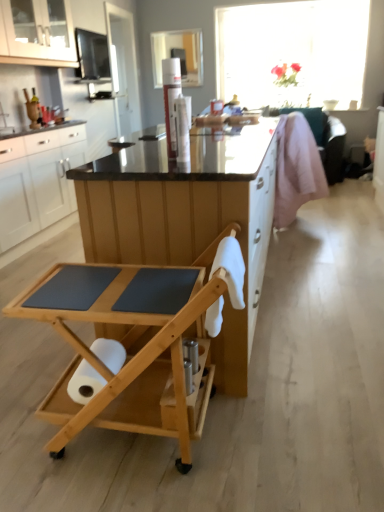
Measure the distance between white matte cabinet at left, arranged as the first cabinetry when ordered from the bottom, and camera.

white matte cabinet at left, arranged as the first cabinetry when ordered from the bottom, and camera are 2.90 meters apart.

Identify the location of white matte toilet paper at lower left. (85, 383).

The image size is (384, 512). Describe the element at coordinates (130, 340) in the screenshot. I see `natural wood rolling cart at center` at that location.

How much space does white glossy cabinet at upper left, placed as the 1th cabinetry when sorted from top to bottom, occupy horizontally?

The width of white glossy cabinet at upper left, placed as the 1th cabinetry when sorted from top to bottom, is 11.43 inches.

The height and width of the screenshot is (512, 384). Describe the element at coordinates (37, 33) in the screenshot. I see `white glossy cabinet at upper left, placed as the 1th cabinetry when sorted from top to bottom` at that location.

The width and height of the screenshot is (384, 512). I want to click on transparent glass vase at upper center, so click(x=292, y=52).

From a real-world perspective, is white matte toilet paper at lower left positioned under transparent glass vase at upper center based on gravity?

Indeed, from a real-world perspective, white matte toilet paper at lower left is positioned beneath transparent glass vase at upper center.

Looking at this image, considering the sizes of objects white matte toilet paper at lower left and transparent glass vase at upper center in the image provided, who is shorter, white matte toilet paper at lower left or transparent glass vase at upper center?

white matte toilet paper at lower left.

The height and width of the screenshot is (512, 384). Find the location of `window located on the right of white matte toilet paper at lower left`. window located on the right of white matte toilet paper at lower left is located at coordinates (292, 52).

Which object is closer to the camera taking this photo, white matte cabinet at left, which appears as the 2th cabinetry when viewed from the top, or natural wood rolling cart at center?

natural wood rolling cart at center is closer to the camera.

Can you tell me how much white matte cabinet at left, which appears as the 2th cabinetry when viewed from the top, and natural wood rolling cart at center differ in facing direction?

87.2 degrees.

Can you confirm if white matte cabinet at left, arranged as the first cabinetry when ordered from the bottom, is smaller than natural wood rolling cart at center?

Actually, white matte cabinet at left, arranged as the first cabinetry when ordered from the bottom, might be larger than natural wood rolling cart at center.

In the scene shown: Which object is thinner, white matte cabinet at left, which appears as the 2th cabinetry when viewed from the top, or natural wood rolling cart at center?

With smaller width is white matte cabinet at left, which appears as the 2th cabinetry when viewed from the top.

Which of these two, natural wood rolling cart at center or transparent glass vase at upper center, is smaller?

With smaller size is natural wood rolling cart at center.

Is natural wood rolling cart at center outside of transparent glass vase at upper center?

Yes.

Is natural wood rolling cart at center aimed at transparent glass vase at upper center?

No.

Is point (30, 313) behind point (316, 98)?

No.

Is wooden rolling cart at center positioned with its back to white glossy cabinet at upper left, placed as the 1th cabinetry when sorted from top to bottom?

No, white glossy cabinet at upper left, placed as the 1th cabinetry when sorted from top to bottom, is not at the back of wooden rolling cart at center.

Would you say wooden rolling cart at center is inside or outside white glossy cabinet at upper left, placed as the 1th cabinetry when sorted from top to bottom?

wooden rolling cart at center exists outside the volume of white glossy cabinet at upper left, placed as the 1th cabinetry when sorted from top to bottom.

Does wooden rolling cart at center come behind white glossy cabinet at upper left, placed as the 1th cabinetry when sorted from top to bottom?

That is False.

Between point (192, 220) and point (6, 8), which one is positioned in front?

The point (192, 220) is more forward.

Is wooden rolling cart at center at the right side of transparent glass vase at upper center?

In fact, wooden rolling cart at center is to the left of transparent glass vase at upper center.

Is wooden rolling cart at center taller or shorter than transparent glass vase at upper center?

Clearly, wooden rolling cart at center is shorter compared to transparent glass vase at upper center.

From a real-world perspective, does wooden rolling cart at center sit lower than transparent glass vase at upper center?

Correct, in the physical world, wooden rolling cart at center is lower than transparent glass vase at upper center.

From the picture: From the image's perspective, is white matte cabinet at left, arranged as the first cabinetry when ordered from the bottom, located above white matte toilet paper at lower left?

Yes, from the image's perspective, white matte cabinet at left, arranged as the first cabinetry when ordered from the bottom, is above white matte toilet paper at lower left.

Who is bigger, white matte cabinet at left, arranged as the first cabinetry when ordered from the bottom, or white matte toilet paper at lower left?

Bigger between the two is white matte cabinet at left, arranged as the first cabinetry when ordered from the bottom.

Between white matte cabinet at left, which appears as the 2th cabinetry when viewed from the top, and white matte toilet paper at lower left, which one has smaller width?

With smaller width is white matte toilet paper at lower left.

Visually, is white matte cabinet at left, arranged as the first cabinetry when ordered from the bottom, positioned to the left or to the right of white matte toilet paper at lower left?

From the image, it's evident that white matte cabinet at left, arranged as the first cabinetry when ordered from the bottom, is to the left of white matte toilet paper at lower left.

Is point (79, 365) less distant than point (22, 44)?

Yes, point (79, 365) is in front of point (22, 44).

Between white matte toilet paper at lower left and white glossy cabinet at upper left, placed as the 1th cabinetry when sorted from top to bottom, which one appears on the right side from the viewer's perspective?

Positioned to the right is white matte toilet paper at lower left.

Between white matte toilet paper at lower left and white glossy cabinet at upper left, placed as the 1th cabinetry when sorted from top to bottom, which one has larger size?

white glossy cabinet at upper left, placed as the 1th cabinetry when sorted from top to bottom, is bigger.

Locate an element on the screen. window above the white matte toilet paper at lower left (from a real-world perspective) is located at coordinates (292, 52).

Identify the location of table below the white matte cabinet at left, arranged as the first cabinetry when ordered from the bottom (from the image's perspective). This screenshot has height=512, width=384. (130, 340).

Considering their positions, is white glossy cabinet at upper left, which is the 2th cabinetry from bottom to top, positioned further to white matte cabinet at left, arranged as the first cabinetry when ordered from the bottom, than natural wood rolling cart at center?

The object further to white matte cabinet at left, arranged as the first cabinetry when ordered from the bottom, is natural wood rolling cart at center.

Looking at the image, which one is located closer to wooden rolling cart at center, pink fabric swivel chair at right or transparent glass vase at upper center?

pink fabric swivel chair at right lies closer to wooden rolling cart at center than the other object.

Based on the photo, looking at the image, which one is located further to wooden rolling cart at center, natural wood rolling cart at center or pink fabric swivel chair at right?

pink fabric swivel chair at right lies further to wooden rolling cart at center than the other object.

Which object lies nearer to the anchor point pink fabric swivel chair at right, white glossy cabinet at upper left, placed as the 1th cabinetry when sorted from top to bottom, or white matte cabinet at left, arranged as the first cabinetry when ordered from the bottom?

white matte cabinet at left, arranged as the first cabinetry when ordered from the bottom, lies closer to pink fabric swivel chair at right than the other object.

Which object lies nearer to the anchor point wooden rolling cart at center, white glossy cabinet at upper left, which is the 2th cabinetry from bottom to top, or pink fabric swivel chair at right?

The object closer to wooden rolling cart at center is pink fabric swivel chair at right.

From the image, which object appears to be nearer to wooden rolling cart at center, transparent glass vase at upper center or natural wood rolling cart at center?

Based on the image, natural wood rolling cart at center appears to be nearer to wooden rolling cart at center.

From the image, which object appears to be nearer to white matte toilet paper at lower left, pink fabric swivel chair at right or natural wood rolling cart at center?

Among the two, natural wood rolling cart at center is located nearer to white matte toilet paper at lower left.

Looking at the image, which one is located further to white matte toilet paper at lower left, natural wood rolling cart at center or wooden rolling cart at center?

The object further to white matte toilet paper at lower left is wooden rolling cart at center.

Locate an element on the screen. swivel chair between white matte toilet paper at lower left and transparent glass vase at upper center in the front-back direction is located at coordinates (296, 168).

Locate an element on the screen. The width and height of the screenshot is (384, 512). toilet paper positioned between wooden rolling cart at center and pink fabric swivel chair at right from near to far is located at coordinates (85, 383).

Locate an element on the screen. The width and height of the screenshot is (384, 512). cabinetry between white glossy cabinet at upper left, placed as the 1th cabinetry when sorted from top to bottom, and natural wood rolling cart at center in the up-down direction is located at coordinates (37, 186).

Identify the location of toilet paper positioned between wooden rolling cart at center and white matte cabinet at left, which appears as the 2th cabinetry when viewed from the top, from near to far. This screenshot has height=512, width=384. (85, 383).